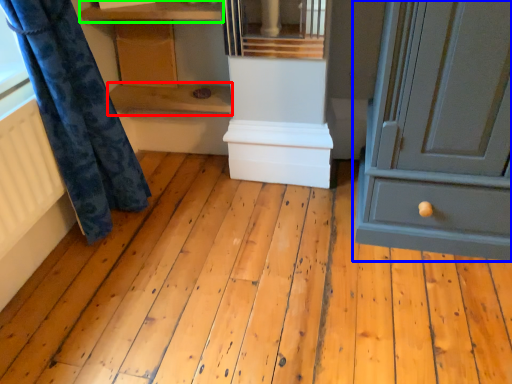
Question: Based on their relative distances, which object is farther from shelf (highlighted by a red box)? Choose from chest of drawers (highlighted by a blue box) and shelf (highlighted by a green box).

Choices:
 (A) chest of drawers
 (B) shelf

Answer: (A)